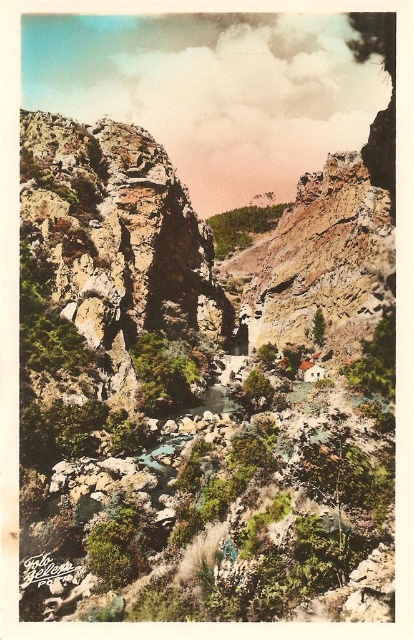
Does green leafy shrubs at center have a greater width compared to green leafy trees at center?

No.

The image size is (414, 640). Describe the element at coordinates (161, 376) in the screenshot. I see `green leafy shrubs at center` at that location.

Image resolution: width=414 pixels, height=640 pixels. I want to click on green leafy shrubs at center, so click(161, 376).